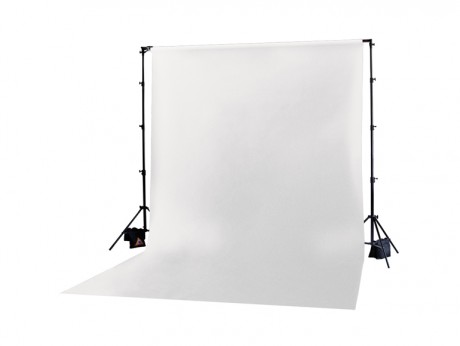
Locate an element on the screen. This screenshot has width=460, height=346. stand is located at coordinates (377, 238).